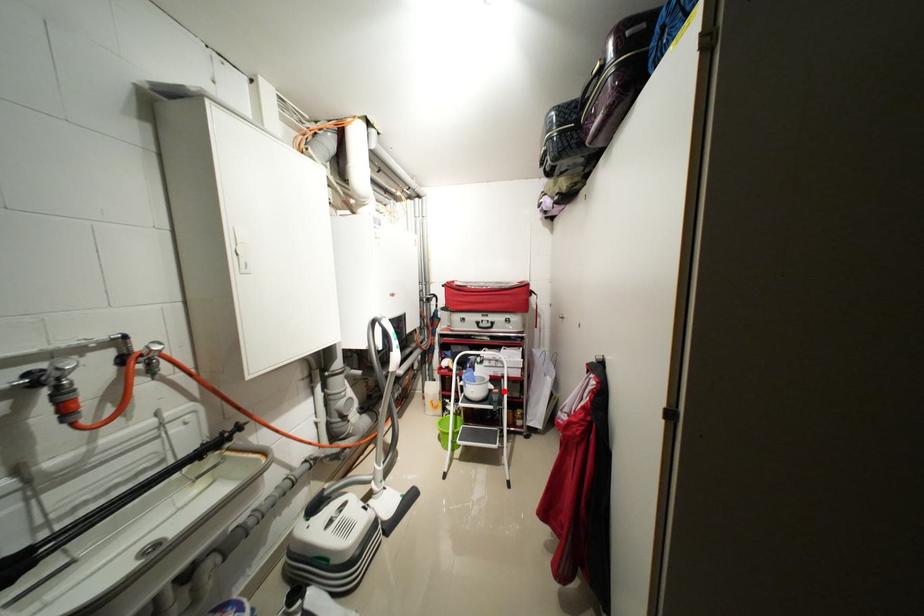
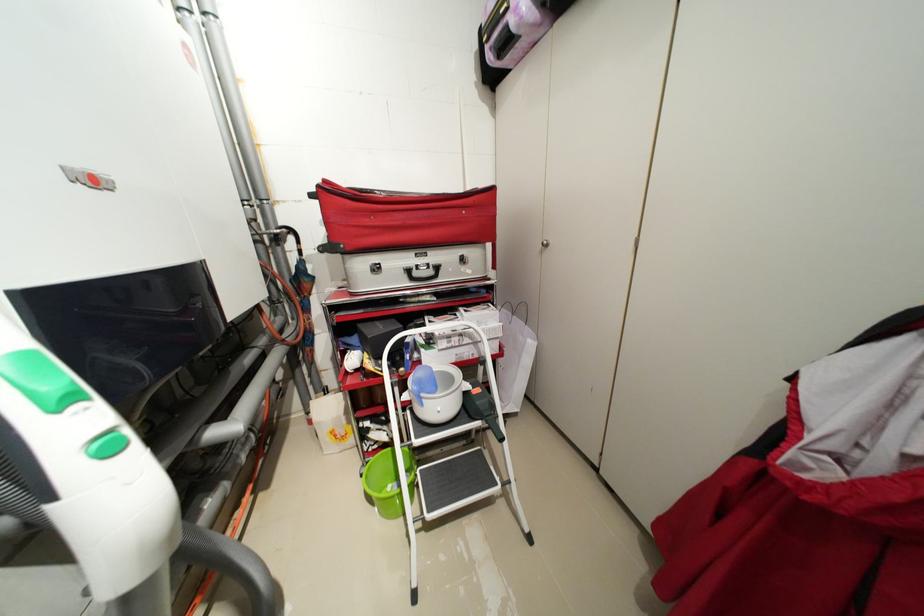
Find the pixel in the second image that matches the highlighted location in the first image.

(484, 391)